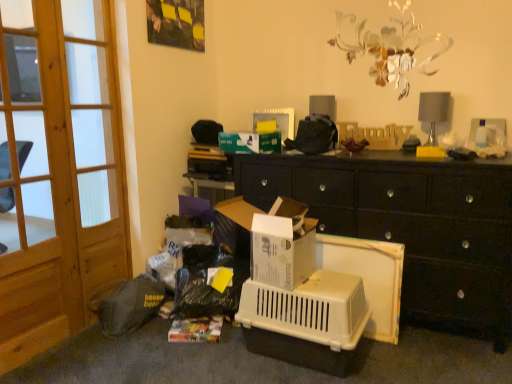
Question: Is point (15, 41) closer or farther from the camera than point (65, 97)?

Choices:
 (A) farther
 (B) closer

Answer: (A)

Question: In terms of width, does wooden screen door at left, which is the 1th screen door in left-to-right order, look wider or thinner when compared to wooden screen door at left, the first screen door positioned from the right?

Choices:
 (A) wide
 (B) thin

Answer: (A)

Question: Which is nearer to the white cardboard box at center?

Choices:
 (A) white plastic cabinet at center
 (B) dark gray fabric bag at lower left
 (C) wooden screen door at left, which ranks as the 2th screen door in right-to-left order
 (D) wooden screen door at left, the first screen door positioned from the right

Answer: (A)

Question: Which object is the closest to the white plastic cabinet at center?

Choices:
 (A) dark gray fabric bag at lower left
 (B) wooden screen door at left, the first screen door positioned from the right
 (C) white cardboard box at center
 (D) wooden screen door at left, which is the 1th screen door in left-to-right order

Answer: (C)